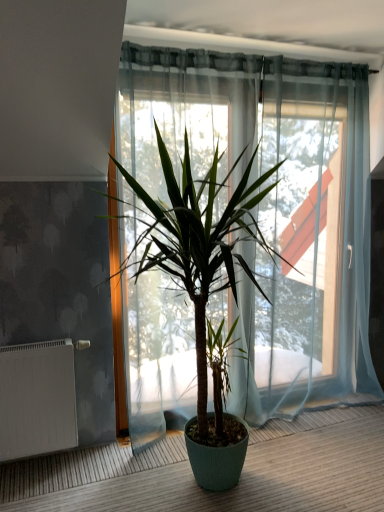
Identify the location of vacant area that is situated to the right of white matte radiator at lower left. This screenshot has height=512, width=384. (104, 457).